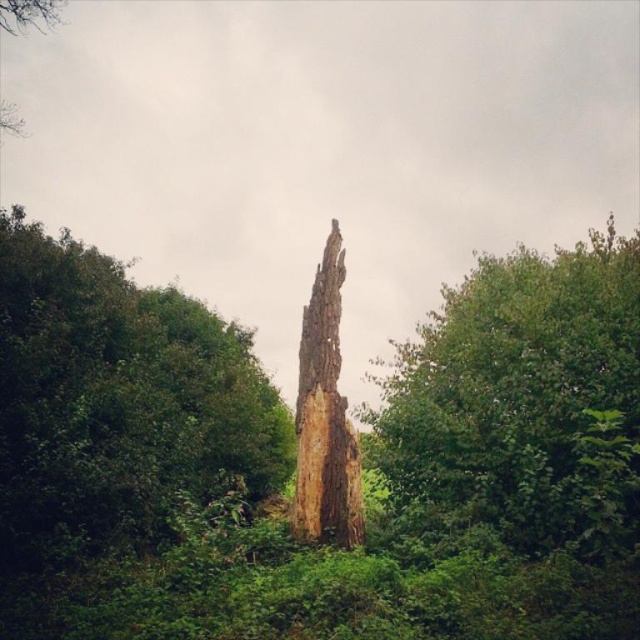
You are an arborist assessing a tree in a forest. You notice two parts of the tree at the center of your view. One is the rough bark tree at center and the other is the smooth brown tree trunk at center. Which part is shorter?

The rough bark tree at center is shorter than the smooth brown tree trunk at center.

In the scene shown: You are a park ranger assessing the stability of the two tree trunks in the scene. Which tree trunk, the smooth brown tree trunk at center or the brown rough tree trunk at center, is wider and therefore potentially more stable?

The smooth brown tree trunk at center is wider than the brown rough tree trunk at center, so it is potentially more stable.

You are a hiker standing in front of the tree trunk and want to determine which of the two points, point (554, 342) or point (310, 522), is closer to you. Based on the scene description, which point is nearer to your current position?

Point (554, 342) is further to the viewer than point (310, 522), so the point closer to you is point (310, 522).